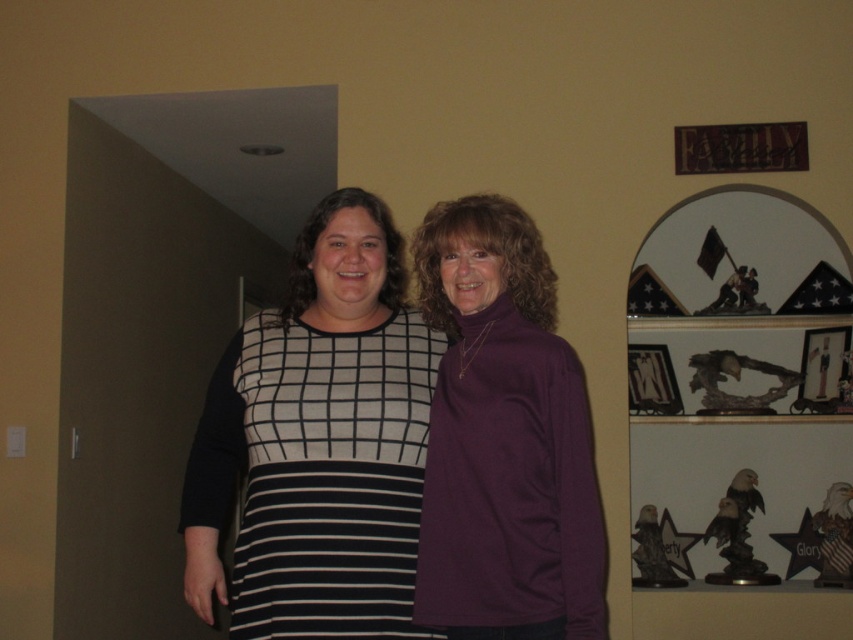
Question: Which object appears farthest from the camera in this image?

Choices:
 (A) metallic silver picture frame at upper right
 (B) matte wooden picture frame at upper right
 (C) black and white striped dress at center

Answer: (A)

Question: Which of the following is the farthest from the observer?

Choices:
 (A) (804, 406)
 (B) (289, 444)
 (C) (656, 346)

Answer: (C)

Question: Based on their relative distances, which object is farther from the purple matte turtleneck sweater at right?

Choices:
 (A) black and white striped dress at center
 (B) matte wooden picture frame at upper right
 (C) metallic silver picture frame at upper right

Answer: (B)

Question: From the image, what is the correct spatial relationship of purple matte turtleneck sweater at right in relation to metallic silver picture frame at upper right?

Choices:
 (A) right
 (B) left

Answer: (B)

Question: Is purple matte turtleneck sweater at right wider than black and white striped dress at center?

Choices:
 (A) no
 (B) yes

Answer: (A)

Question: Is purple matte turtleneck sweater at right bigger than metallic silver picture frame at upper right?

Choices:
 (A) no
 (B) yes

Answer: (B)